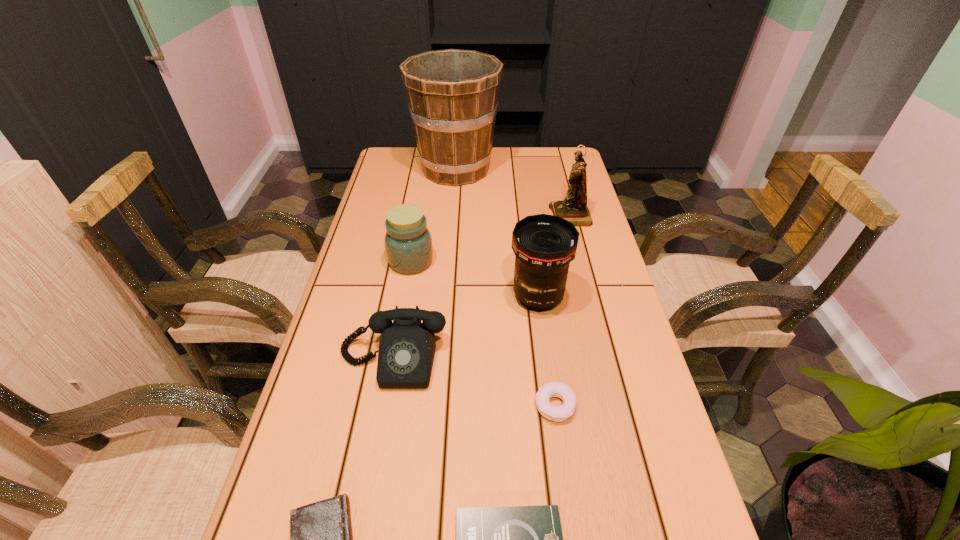
Image resolution: width=960 pixels, height=540 pixels. Find the location of `figurine that is at the right edge`. figurine that is at the right edge is located at coordinates (573, 208).

Where is `telephoto lens that is at the right edge`? telephoto lens that is at the right edge is located at coordinates (544, 245).

Locate an element on the screen. The height and width of the screenshot is (540, 960). object that is positioned at the far left corner is located at coordinates (452, 94).

I want to click on vacant area at the left edge, so click(323, 390).

I want to click on vacant area at the right edge, so click(586, 333).

Locate an element on the screen. vacant position at the far left corner of the desktop is located at coordinates (x=420, y=165).

Identify the location of free area in between the farthest object and the sixth nearest object. (433, 215).

Where is `blank region between the third shortest object and the fifth shortest object`? blank region between the third shortest object and the fifth shortest object is located at coordinates (483, 333).

At what (x,y) coordinates should I click in order to perform the action: click on free space between the fifth shortest object and the tallest object. Please return your answer as a coordinate pair (x, y). Image resolution: width=960 pixels, height=540 pixels. Looking at the image, I should click on (433, 215).

Locate an element on the screen. free area in between the tallest object and the fourth farthest object is located at coordinates (497, 233).